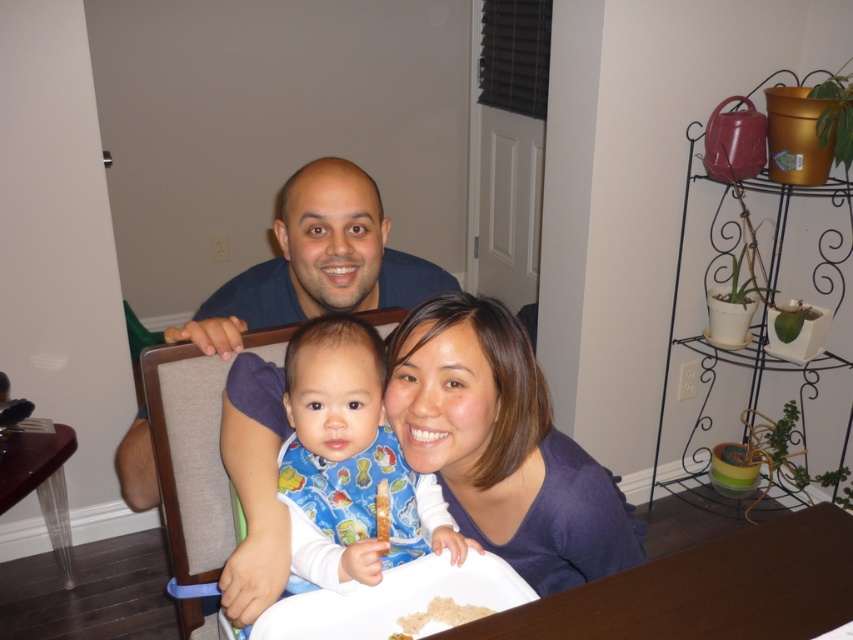
Question: Does brown wooden table at lower center have a larger size compared to fabric high chair at center?

Choices:
 (A) yes
 (B) no

Answer: (B)

Question: Which of the following is the farthest from the observer?

Choices:
 (A) brown crumbly rice at lower center
 (B) matte blue shirt at center

Answer: (B)

Question: Which is nearer to the purple matte shirt at center?

Choices:
 (A) brown wooden table at lower center
 (B) blue fabric bib at center
 (C) fabric high chair at center

Answer: (B)

Question: Is blue fabric bib at center further to the viewer compared to brown glossy table at lower left?

Choices:
 (A) no
 (B) yes

Answer: (A)

Question: Which of these objects is positioned closest to the matte blue shirt at center?

Choices:
 (A) blue fabric bib at center
 (B) brown glossy table at lower left

Answer: (A)

Question: Does fabric high chair at center have a greater width compared to brown crumbly rice at lower center?

Choices:
 (A) yes
 (B) no

Answer: (A)